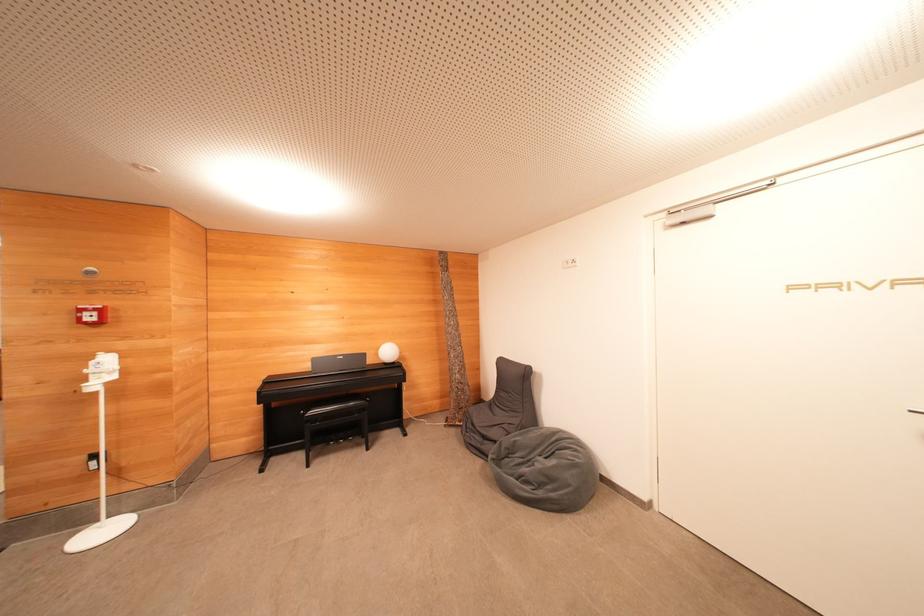
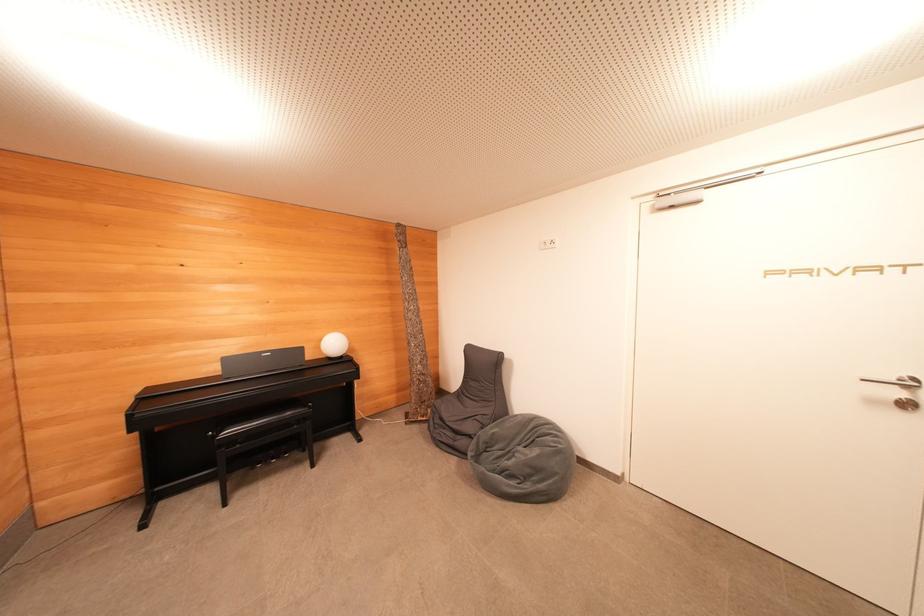
Question: The camera is either moving clockwise (left) or counter-clockwise (right) around the object. The first image is from the beginning of the video and the second image is from the end. Is the camera moving left or right when shooting the video?

Choices:
 (A) Left
 (B) Right

Answer: (A)